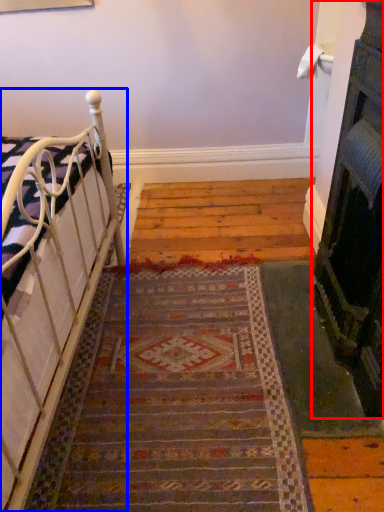
Question: Which point is closer to the camera, fireplace (highlighted by a red box) or furniture (highlighted by a blue box)?

Choices:
 (A) fireplace
 (B) furniture

Answer: (A)